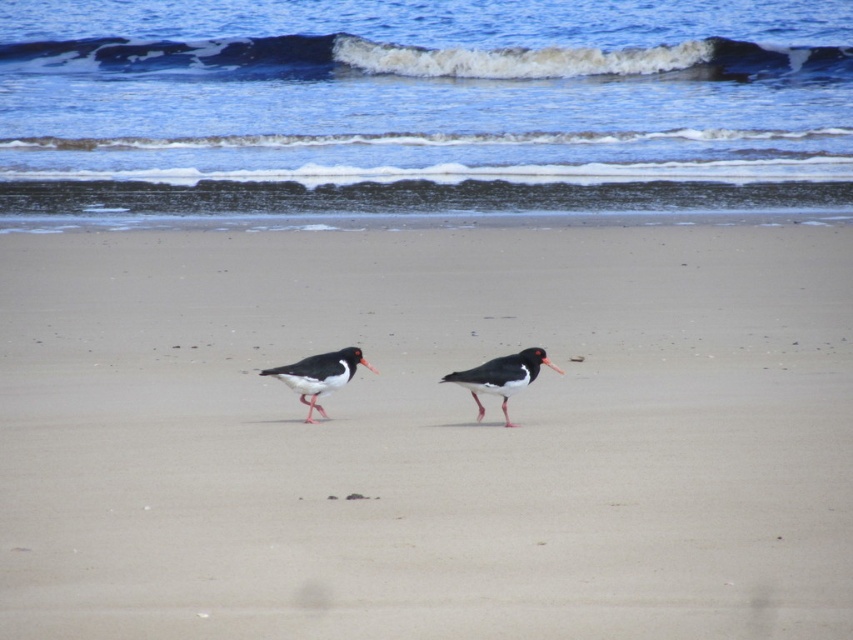
In the scene shown: You are standing on the beach and see two points marked on the sand. The first point is at coordinates point (339, 320) and the second is at point (339, 360). Which point is closer to you?

Point (339, 320) is closer to you because it is further to the viewer than point (339, 360).

You are a photographer standing on the beach and want to take a picture of both the black matte bird at center and the black glossy oystercatcher at center. The minimum distance your camera can focus on two objects clearly is 60 centimeters. Will both birds be in focus in the photo?

The black matte bird at center is 59.98 centimeters from the black glossy oystercatcher at center. Since the distance between them is just below the 60 centimeter minimum focus requirement, the camera may struggle to keep both birds in focus clearly.

You are a photographer trying to capture a clear shot of the black matte bird at center. The smooth sand at center is in the way. Can you estimate if the sand is wider than the bird so you can adjust your camera angle accordingly?

The smooth sand at center might be wider than black matte bird at center, so adjusting your camera angle to avoid the sand might be necessary to ensure the bird is fully visible.